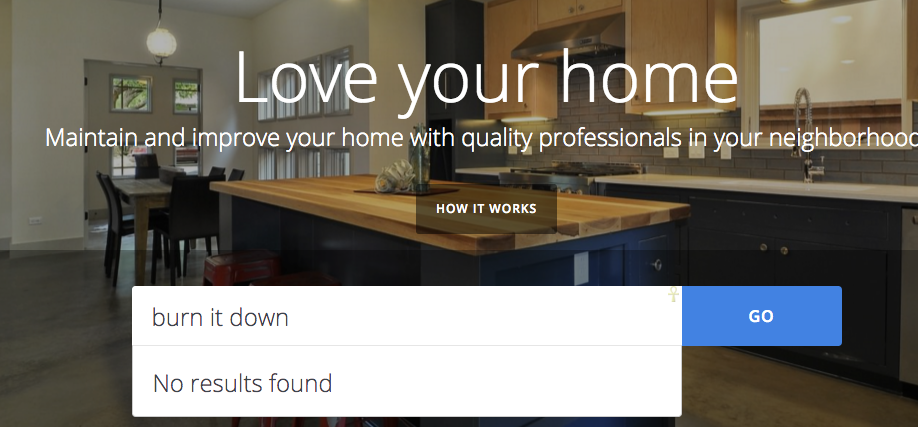
The width and height of the screenshot is (918, 427). I want to click on kitchen light, so pos(163,45), pos(798,5), pos(698,114), pos(532,120), pos(485,126).